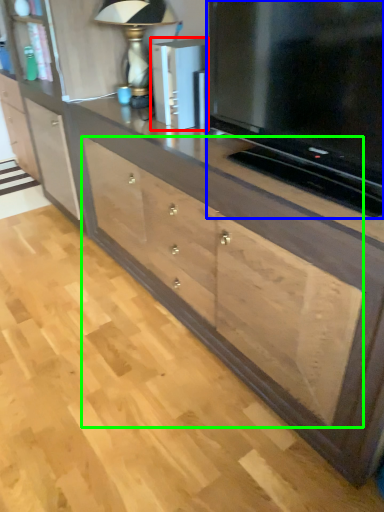
Question: Considering the real-world distances, which object is farthest from appliance (highlighted by a red box)? television (highlighted by a blue box) or drawer (highlighted by a green box)?

Choices:
 (A) television
 (B) drawer

Answer: (B)